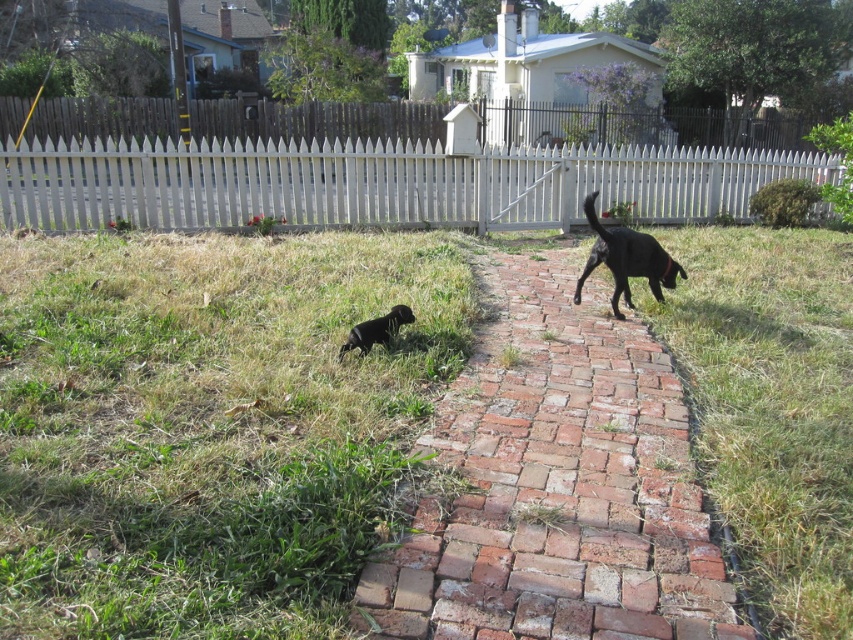
Can you confirm if brick at center is smaller than shiny black dog at right?

No.

Between point (521, 371) and point (635, 236), which one is positioned in front?

Point (521, 371)

Does point (381, 618) come farther from viewer compared to point (631, 252)?

No.

Locate an element on the screen. The image size is (853, 640). brick at center is located at coordinates (556, 484).

In the scene shown: Does green grass at lower left appear on the right side of brick at center?

In fact, green grass at lower left is to the left of brick at center.

Which is above, green grass at lower left or brick at center?

green grass at lower left

Find the location of `green grass at lower left`. green grass at lower left is located at coordinates (207, 426).

At what (x,y) coordinates should I click in order to perform the action: click on green grass at lower left. Please return your answer as a coordinate pair (x, y). This screenshot has width=853, height=640. Looking at the image, I should click on (207, 426).

Who is more forward, (483, 637) or (151, 182)?

Point (483, 637) is more forward.

In the scene shown: Does brick at center have a greater height compared to white picket fence at upper center?

No, brick at center is not taller than white picket fence at upper center.

The image size is (853, 640). I want to click on brick at center, so click(556, 484).

Where is `brick at center`? brick at center is located at coordinates (556, 484).